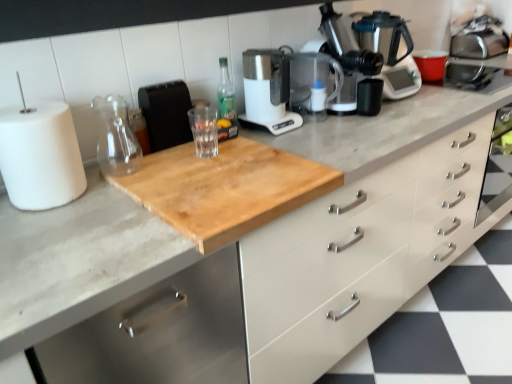
I want to click on free space in front of white matte paper towel at left, so click(x=42, y=225).